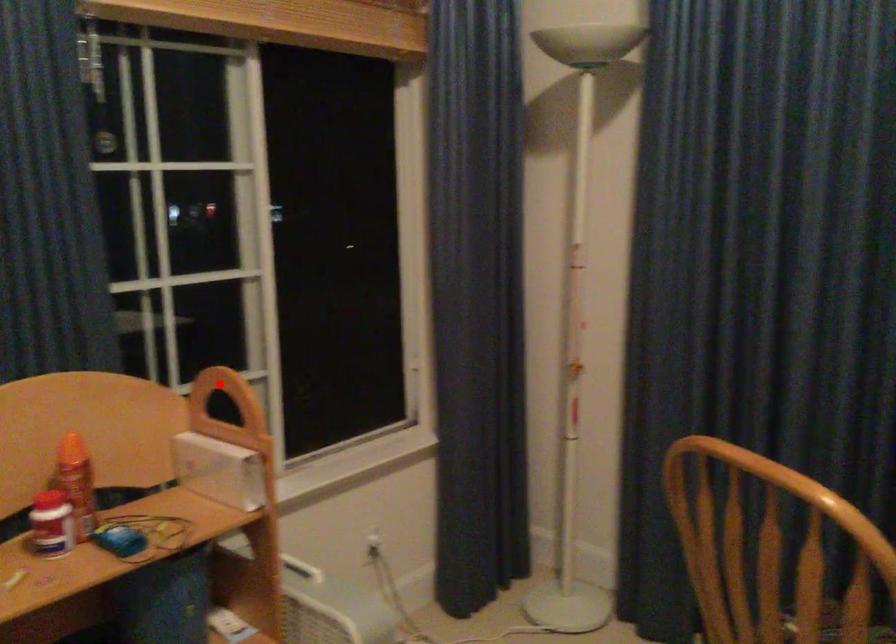
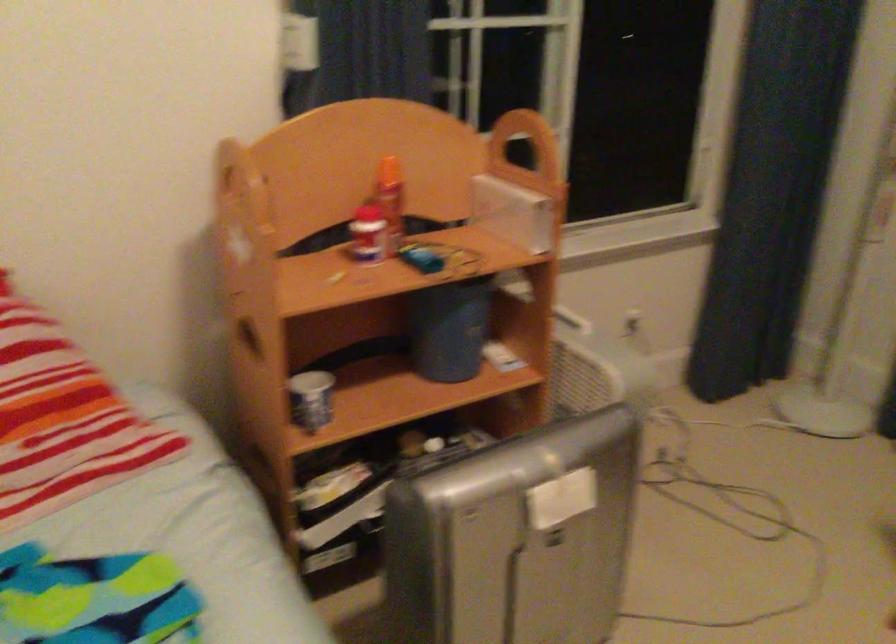
Where in the second image is the point corresponding to the highlighted location from the first image?

(512, 128)